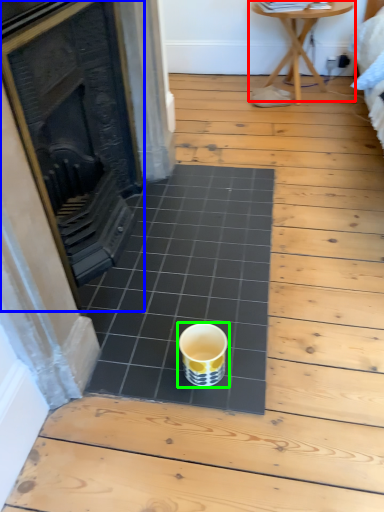
Question: Considering the real-world distances, which object is farthest from table (highlighted by a red box)? fireplace (highlighted by a blue box) or coffee cup (highlighted by a green box)?

Choices:
 (A) fireplace
 (B) coffee cup

Answer: (B)